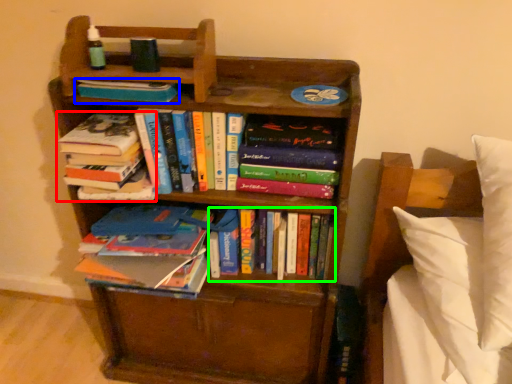
Question: Which object is positioned closest to book (highlighted by a red box)? Select from book (highlighted by a blue box) and book (highlighted by a green box).

Choices:
 (A) book
 (B) book

Answer: (A)